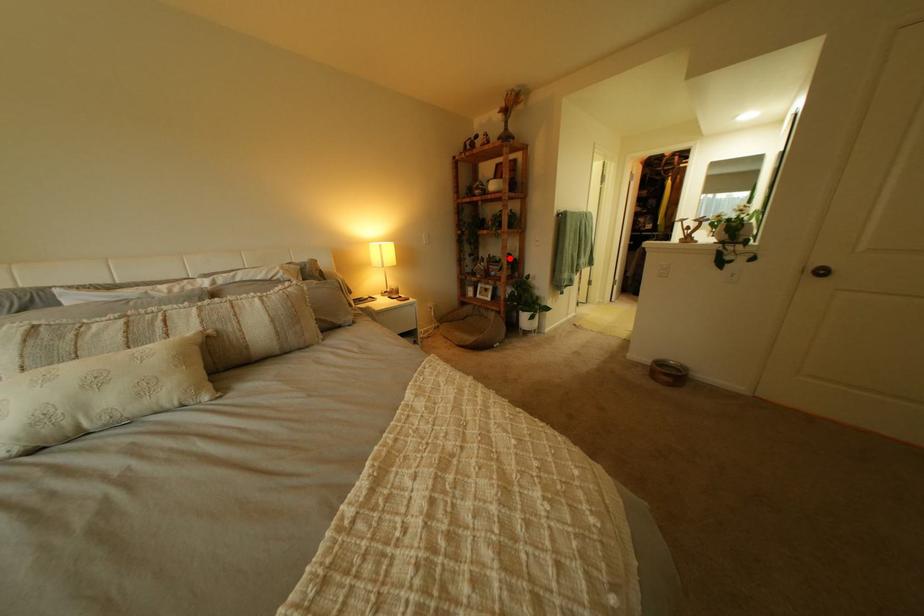
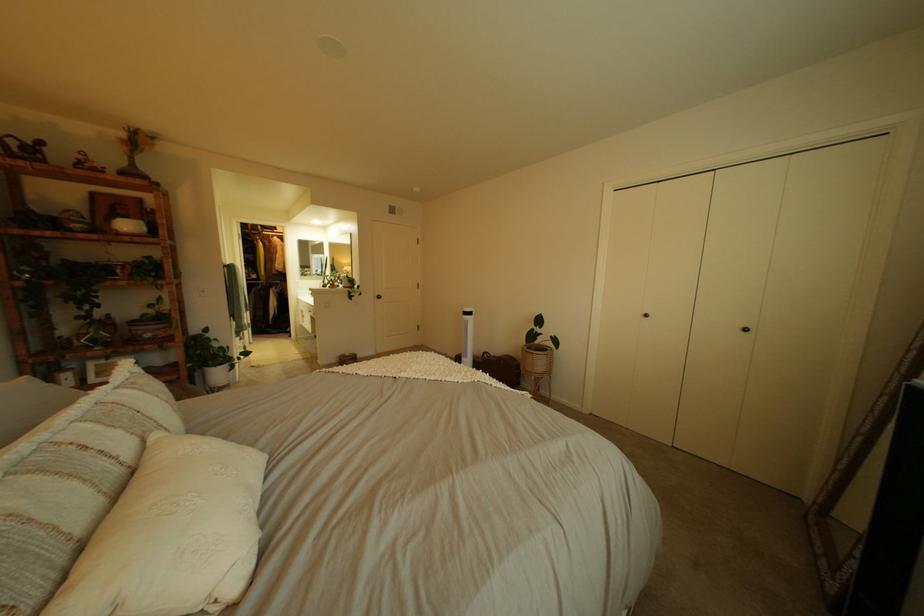
In the second image, find the point that corresponds to the highlighted location in the first image.

(161, 315)